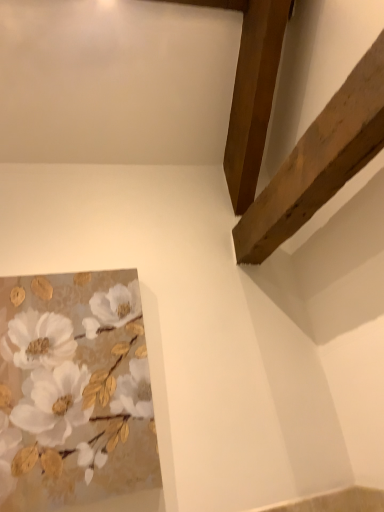
The image size is (384, 512). What do you see at coordinates (74, 391) in the screenshot?
I see `matte gold floral arrangement at lower left` at bounding box center [74, 391].

The width and height of the screenshot is (384, 512). What are the coordinates of `matte gold floral arrangement at lower left` in the screenshot? It's located at (74, 391).

Image resolution: width=384 pixels, height=512 pixels. I want to click on matte gold floral arrangement at lower left, so click(74, 391).